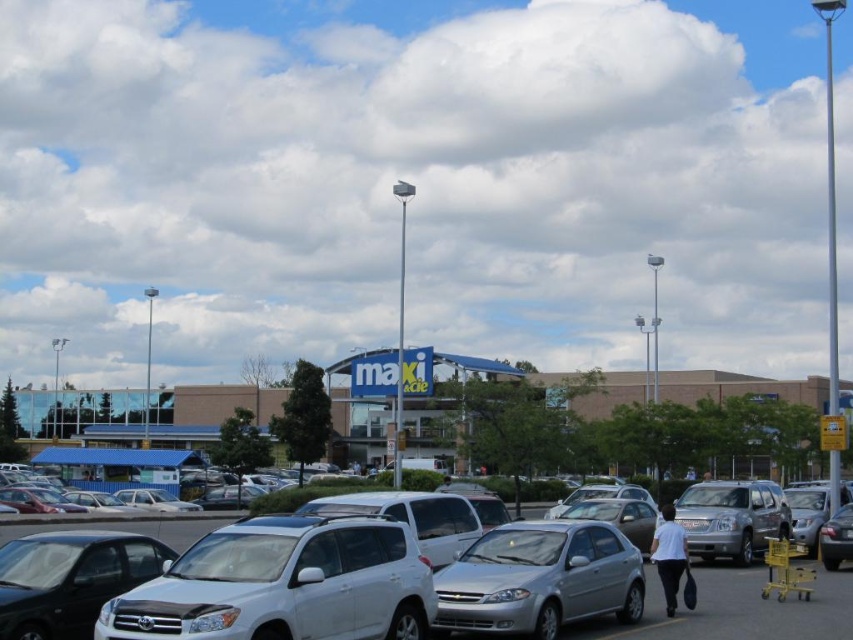
Is silver metallic sedan at center smaller than white matte car at center?

Yes, silver metallic sedan at center is smaller than white matte car at center.

Which is in front, point (440, 600) or point (682, 636)?

Point (440, 600) is more forward.

Which is behind, point (639, 612) or point (703, 577)?

The point (703, 577) is behind.

Where is `silver metallic sedan at center`? This screenshot has height=640, width=853. silver metallic sedan at center is located at coordinates (540, 579).

Is white matte suv at center thinner than silver metallic sedan at center?

Incorrect, white matte suv at center's width is not less than silver metallic sedan at center's.

Can you confirm if white matte suv at center is bigger than silver metallic sedan at center?

Correct, white matte suv at center is larger in size than silver metallic sedan at center.

Is point (149, 602) positioned after point (456, 566)?

No, it is not.

The image size is (853, 640). What are the coordinates of `white matte suv at center` in the screenshot? It's located at (283, 584).

From the picture: Can you confirm if white matte car at center is taller than shiny black sedan at lower left?

Correct, white matte car at center is much taller as shiny black sedan at lower left.

Is white matte car at center smaller than shiny black sedan at lower left?

No.

In the scene shown: Measure the distance between point (524,508) and camera.

51.39 meters

Where is `white matte car at center`? white matte car at center is located at coordinates (737, 609).